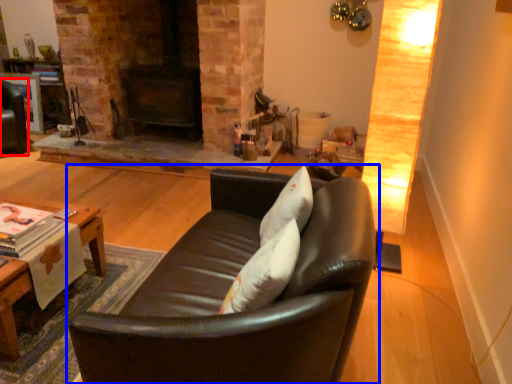
Question: Which object appears farthest to the camera in this image, swivel chair (highlighted by a red box) or studio couch (highlighted by a blue box)?

Choices:
 (A) swivel chair
 (B) studio couch

Answer: (A)